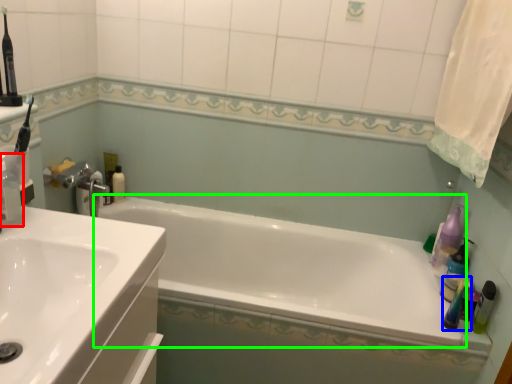
Question: Which is nearer to the cleaning product (highlighted by a red box)? mouthwash (highlighted by a blue box) or bathtub (highlighted by a green box).

Choices:
 (A) mouthwash
 (B) bathtub

Answer: (B)